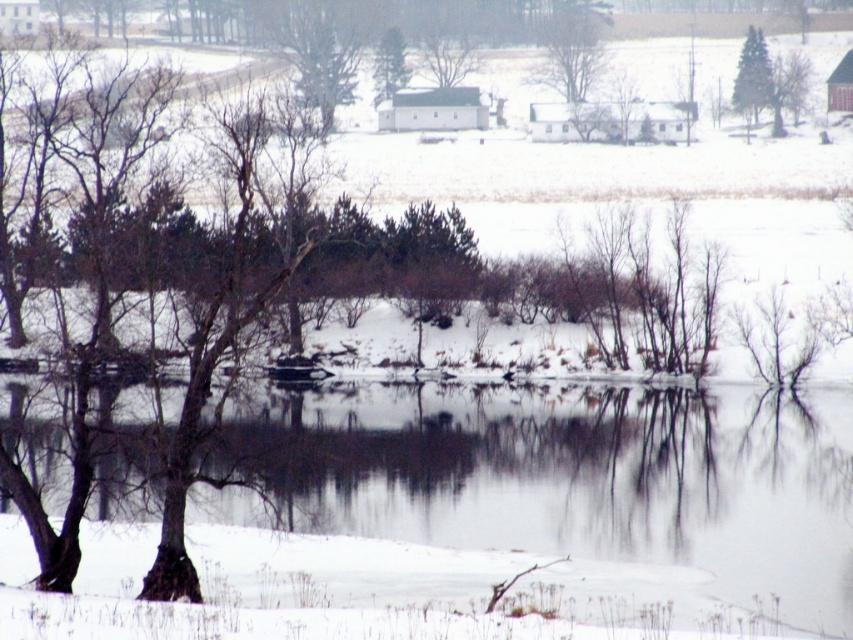
Which is more to the right, clear water at lower center or smooth bark tree at upper right?

From the viewer's perspective, smooth bark tree at upper right appears more on the right side.

Is point (735, 529) farther from camera compared to point (788, 52)?

No, it is in front of (788, 52).

Is point (801, 561) closer to viewer compared to point (770, 102)?

Yes.

The width and height of the screenshot is (853, 640). In order to click on clear water at lower center in this screenshot , I will do tap(570, 477).

Find the location of `green matte tree at upper right`. green matte tree at upper right is located at coordinates (752, 76).

Where is `green matte tree at upper right`? The width and height of the screenshot is (853, 640). green matte tree at upper right is located at coordinates (752, 76).

Which of these two, clear water at lower center or green matte tree at upper center, stands taller?

clear water at lower center

Does clear water at lower center appear on the right side of green matte tree at upper center?

Correct, you'll find clear water at lower center to the right of green matte tree at upper center.

Does point (645, 509) come closer to viewer compared to point (386, 36)?

Yes, point (645, 509) is in front of point (386, 36).

This screenshot has height=640, width=853. What are the coordinates of `clear water at lower center` in the screenshot? It's located at (570, 477).